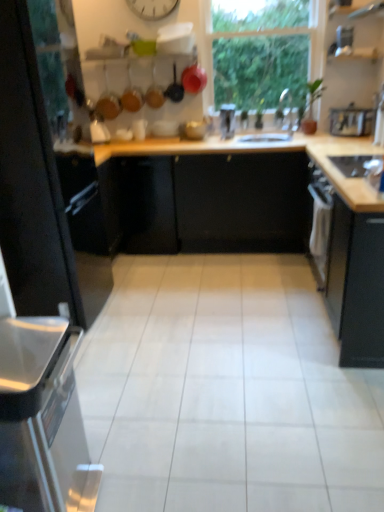
Question: Is black matte cabinet at right, the first cabinetry from the right, oriented towards matte black frying pan at upper center, the 1th frying pan in the right-to-left sequence?

Choices:
 (A) no
 (B) yes

Answer: (A)

Question: From the image's perspective, is black matte cabinet at right, the first cabinetry from the right, beneath matte black frying pan at upper center, the third frying pan from the left?

Choices:
 (A) yes
 (B) no

Answer: (A)

Question: From a real-world perspective, is black matte cabinet at right, which is the 2th cabinetry in left-to-right order, located higher than matte black frying pan at upper center, the 1th frying pan in the right-to-left sequence?

Choices:
 (A) yes
 (B) no

Answer: (B)

Question: Does black matte cabinet at right, the first cabinetry from the right, have a greater width compared to matte black frying pan at upper center, the 1th frying pan in the right-to-left sequence?

Choices:
 (A) no
 (B) yes

Answer: (B)

Question: Is the depth of black matte cabinet at right, which is the 2th cabinetry in left-to-right order, greater than that of matte black frying pan at upper center, the 1th frying pan in the right-to-left sequence?

Choices:
 (A) yes
 (B) no

Answer: (B)

Question: Considering the positions of point (221, 113) and point (269, 117), is point (221, 113) closer or farther from the camera than point (269, 117)?

Choices:
 (A) closer
 (B) farther

Answer: (A)

Question: Considering the positions of metallic silver toaster at center, arranged as the fourth appliance when viewed from the front, and white glossy sink at center in the image, is metallic silver toaster at center, arranged as the fourth appliance when viewed from the front, taller or shorter than white glossy sink at center?

Choices:
 (A) tall
 (B) short

Answer: (B)

Question: Do you think metallic silver toaster at center, which ranks as the 4th appliance in bottom-to-top order, is within white glossy sink at center, or outside of it?

Choices:
 (A) outside
 (B) inside

Answer: (A)

Question: Considering the positions of metallic silver toaster at center, which is the second appliance in top-to-bottom order, and white glossy sink at center in the image, is metallic silver toaster at center, which is the second appliance in top-to-bottom order, bigger or smaller than white glossy sink at center?

Choices:
 (A) big
 (B) small

Answer: (B)

Question: From a real-world perspective, is matte black frying pan at upper center, acting as the 3th frying pan starting from the right, above or below transparent glass window at upper center?

Choices:
 (A) above
 (B) below

Answer: (B)

Question: In terms of height, does matte black frying pan at upper center, the first frying pan positioned from the left, look taller or shorter compared to transparent glass window at upper center?

Choices:
 (A) tall
 (B) short

Answer: (B)

Question: In the image, is matte black frying pan at upper center, the first frying pan positioned from the left, positioned in front of or behind transparent glass window at upper center?

Choices:
 (A) front
 (B) behind

Answer: (B)

Question: Which is correct: matte black frying pan at upper center, acting as the 3th frying pan starting from the right, is inside transparent glass window at upper center, or outside of it?

Choices:
 (A) outside
 (B) inside

Answer: (A)

Question: From the image's perspective, is black matte cabinet at left, which ranks as the 1th cabinetry in left-to-right order, located above or below black matte cabinet at right, which is the 2th cabinetry in left-to-right order?

Choices:
 (A) below
 (B) above

Answer: (B)

Question: Considering their positions, is black matte cabinet at left, which ranks as the 1th cabinetry in left-to-right order, located in front of or behind black matte cabinet at right, the first cabinetry from the right?

Choices:
 (A) front
 (B) behind

Answer: (A)